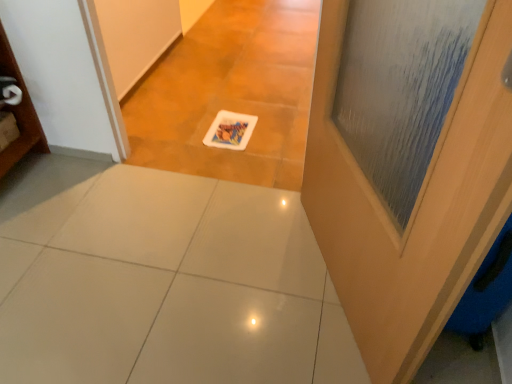
Where is `empty space that is ontop of white glossy tile at center (from a real-world perspective)`? empty space that is ontop of white glossy tile at center (from a real-world perspective) is located at coordinates (173, 270).